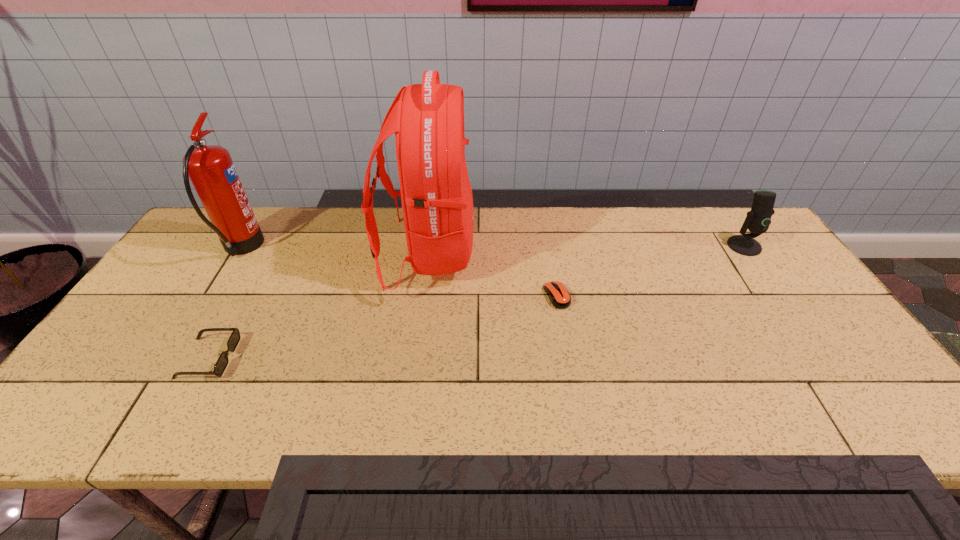
The height and width of the screenshot is (540, 960). In order to click on the tallest object in this screenshot , I will do `click(428, 119)`.

The image size is (960, 540). I want to click on the third object from left to right, so click(x=428, y=119).

Where is `fire extinguisher`? The height and width of the screenshot is (540, 960). fire extinguisher is located at coordinates (211, 170).

This screenshot has width=960, height=540. What are the coordinates of `the rightmost object` in the screenshot? It's located at (757, 221).

This screenshot has width=960, height=540. In order to click on the third shortest object in this screenshot , I will do `click(757, 221)`.

At what (x,y) coordinates should I click in order to perform the action: click on the nearest object. Please return your answer as a coordinate pair (x, y). Looking at the image, I should click on (222, 362).

This screenshot has width=960, height=540. I want to click on sunglasses, so click(222, 362).

Where is `the shortest object`? This screenshot has height=540, width=960. the shortest object is located at coordinates (559, 296).

Locate an element on the screen. The image size is (960, 540). the fourth object from left to right is located at coordinates (559, 296).

Locate an element on the screen. The width and height of the screenshot is (960, 540). free point located on the main compartment of the third object from right to left is located at coordinates (552, 252).